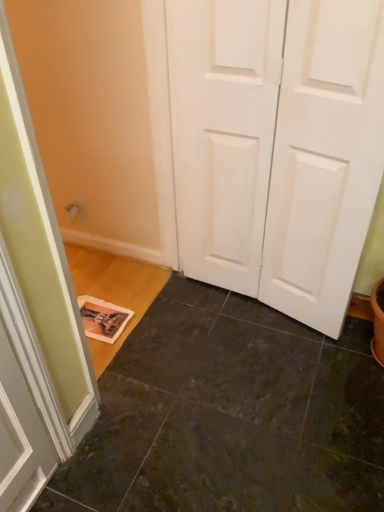
Question: Would you say white matte door at center is to the left or to the right of dark slate tile at lower center in the picture?

Choices:
 (A) left
 (B) right

Answer: (B)

Question: From the image's perspective, relative to dark slate tile at lower center, is white matte door at center above or below?

Choices:
 (A) below
 (B) above

Answer: (B)

Question: From a real-world perspective, is white matte door at center positioned above or below dark slate tile at lower center?

Choices:
 (A) below
 (B) above

Answer: (B)

Question: Is dark slate tile at lower center in front of or behind white matte door at center in the image?

Choices:
 (A) front
 (B) behind

Answer: (A)

Question: In terms of width, does dark slate tile at lower center look wider or thinner when compared to white matte door at center?

Choices:
 (A) wide
 (B) thin

Answer: (A)

Question: Is dark slate tile at lower center bigger or smaller than white matte door at center?

Choices:
 (A) small
 (B) big

Answer: (A)

Question: Considering the positions of dark slate tile at lower center and white matte door at center in the image, is dark slate tile at lower center taller or shorter than white matte door at center?

Choices:
 (A) short
 (B) tall

Answer: (A)